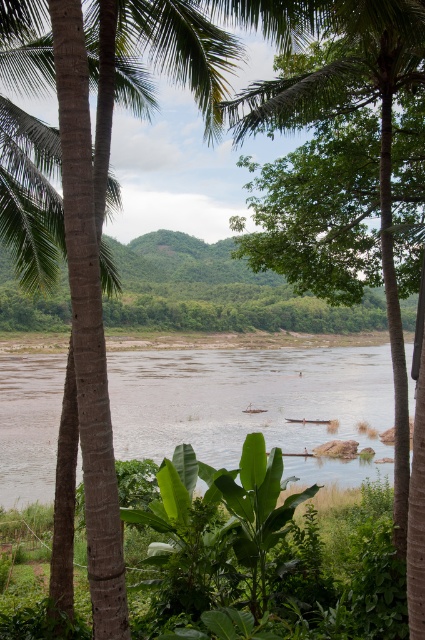
Question: Which is nearer to the brown muddy water at center?

Choices:
 (A) green leafy palm tree at center
 (B) green textured palm tree at left

Answer: (A)

Question: Based on their relative distances, which object is nearer to the green leafy palm tree at center?

Choices:
 (A) brown muddy water at center
 (B) green textured palm tree at left

Answer: (B)

Question: Considering the relative positions of green leafy palm tree at center and brown muddy water at center in the image provided, where is green leafy palm tree at center located with respect to brown muddy water at center?

Choices:
 (A) right
 (B) left

Answer: (A)

Question: Which of the following is the closest to the observer?

Choices:
 (A) green textured palm tree at left
 (B) green leafy palm tree at center

Answer: (B)

Question: Does brown muddy water at center appear on the right side of green textured palm tree at left?

Choices:
 (A) no
 (B) yes

Answer: (A)

Question: Is green leafy palm tree at center bigger than brown muddy water at center?

Choices:
 (A) yes
 (B) no

Answer: (B)